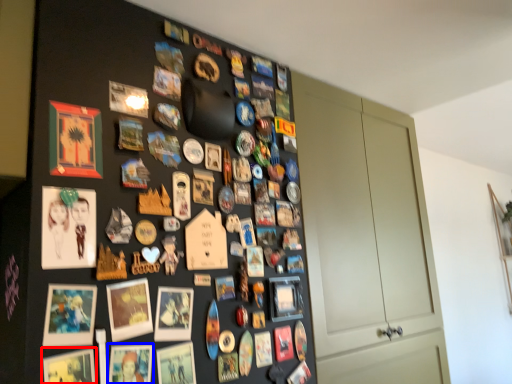
Question: Which object appears closest to the camera in this image, picture frame (highlighted by a red box) or picture frame (highlighted by a blue box)?

Choices:
 (A) picture frame
 (B) picture frame

Answer: (A)